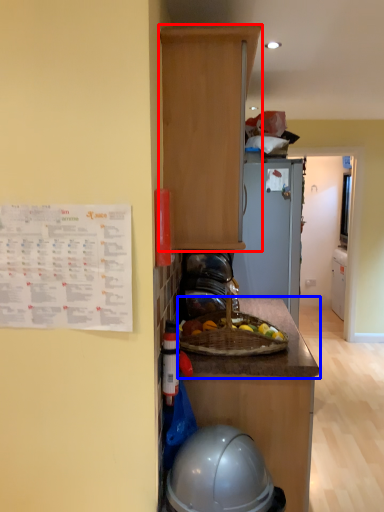
Question: Which of the following is the closest to the observer, cabinetry (highlighted by a red box) or countertop (highlighted by a blue box)?

Choices:
 (A) cabinetry
 (B) countertop

Answer: (A)